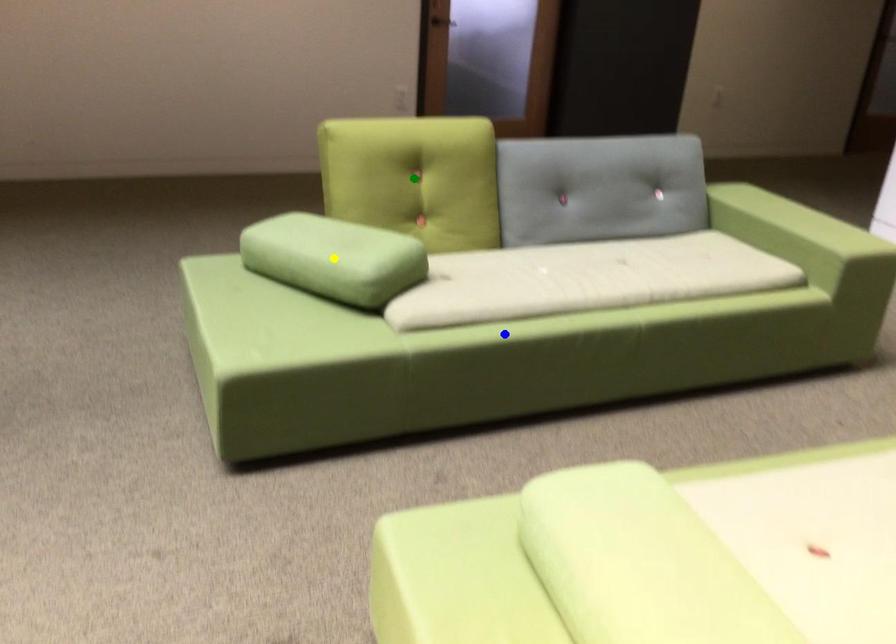
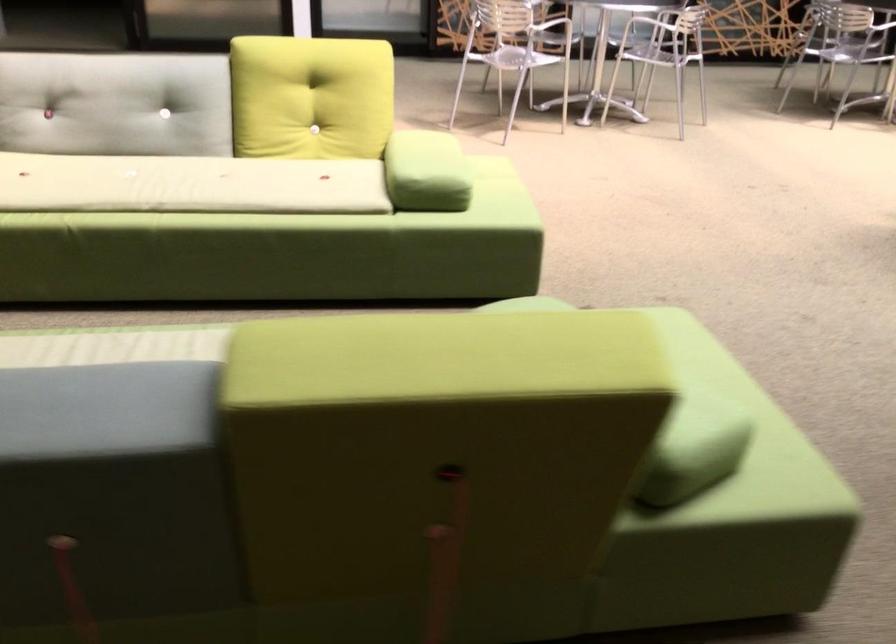
I am providing you with two images of the same scene from different viewpoints. Three points are marked in image1. Which point corresponds to a part or object that is occluded in image2?In image1, three points are marked. Which of them correspond to a part or object that is occluded in image2?Among the three points shown in image1, which one corresponds to a part or object that is no longer visible due to occlusion in image2?

green point, blue point, yellow point